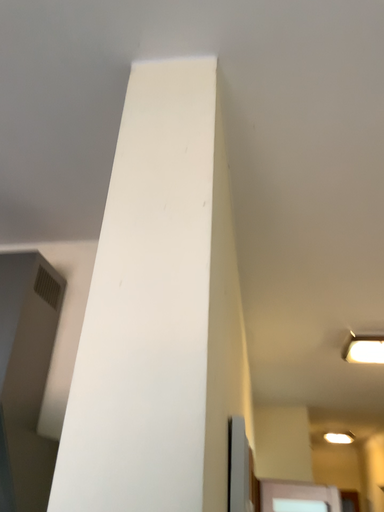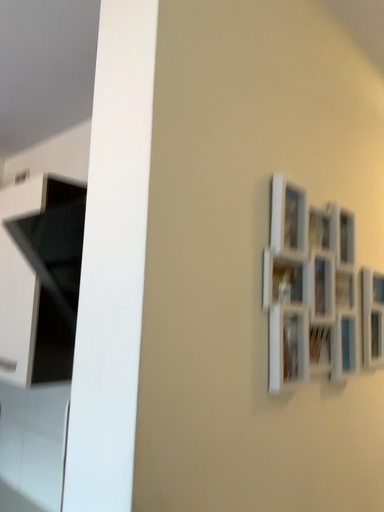
Question: How did the camera likely rotate when shooting the video?

Choices:
 (A) rotated downward
 (B) rotated upward

Answer: (A)